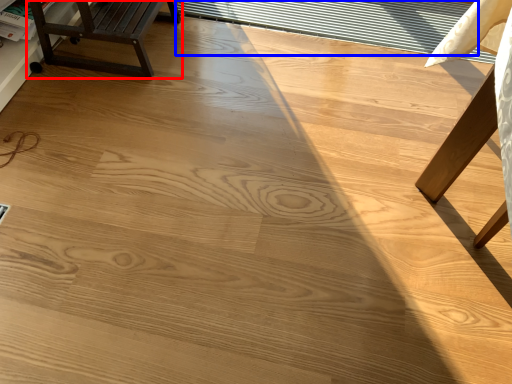
Question: Which point is further to the camera, furniture (highlighted by a red box) or window (highlighted by a blue box)?

Choices:
 (A) furniture
 (B) window

Answer: (B)